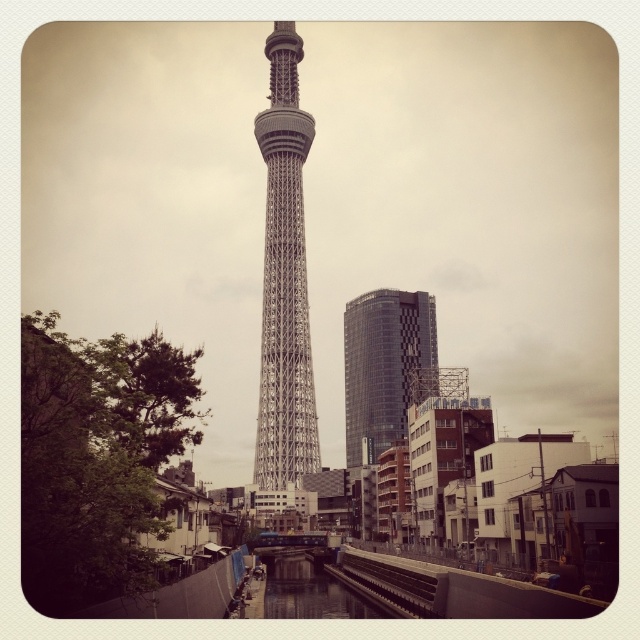
Question: Observing the image, what is the correct spatial positioning of silver metallic tower at center in reference to glassy reflective skyscraper at center?

Choices:
 (A) above
 (B) below

Answer: (A)

Question: Is silver metallic tower at center thinner than glassy reflective skyscraper at center?

Choices:
 (A) yes
 (B) no

Answer: (A)

Question: Which of the following is the closest to the observer?

Choices:
 (A) (298, 436)
 (B) (342, 333)

Answer: (A)

Question: Does silver metallic tower at center have a greater width compared to glassy reflective skyscraper at center?

Choices:
 (A) yes
 (B) no

Answer: (B)